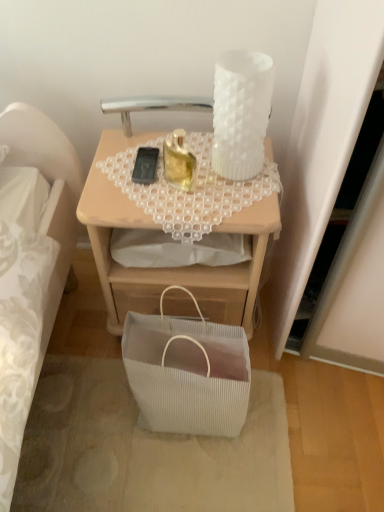
You are a GUI agent. You are given a task and a screenshot of the screen. Output one action in this format:
    pyautogui.click(x=<x>, y=<y>)
    Task: Click on the vacant area that is in front of translucent glass candle at upper center, arranged as the first candle holder when viewed from the left
    
    Given the screenshot: What is the action you would take?
    pyautogui.click(x=181, y=205)